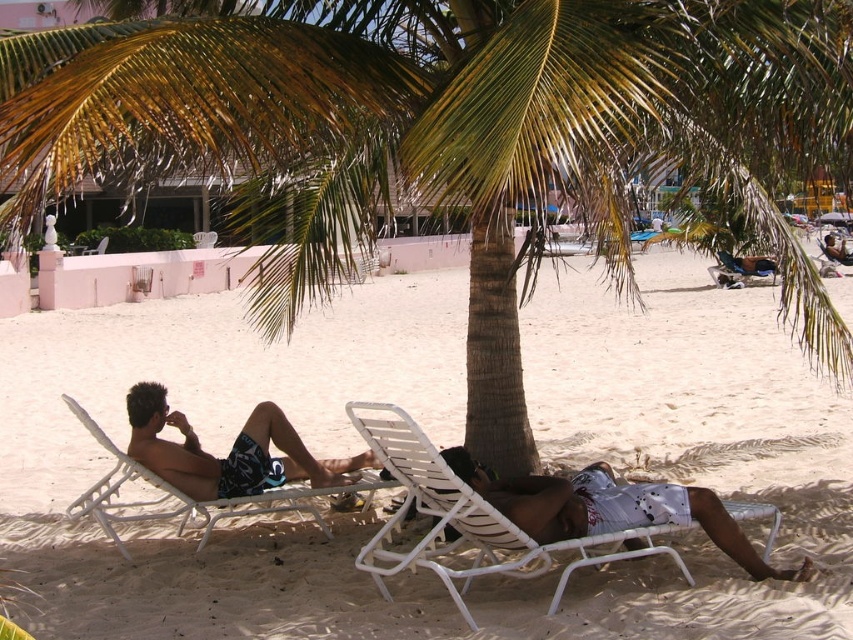
Question: Does white plastic beach chair at lower center appear under dark blue printed shorts at center?

Choices:
 (A) no
 (B) yes

Answer: (B)

Question: Is white plastic chair at left to the right of blue fabric beach chair at center from the viewer's perspective?

Choices:
 (A) no
 (B) yes

Answer: (A)

Question: In this image, where is white plastic beach chair at lower center located relative to white textured shorts at lower right?

Choices:
 (A) below
 (B) above

Answer: (A)

Question: Which point is closer to the camera?

Choices:
 (A) (590, 333)
 (B) (305, 241)
 (C) (386, 428)
 (D) (103, 244)

Answer: (C)

Question: Which point is farther to the camera?

Choices:
 (A) white sand at center
 (B) dark blue printed shorts at center
 (C) blue fabric beach chair at center
 (D) white textured shorts at lower right

Answer: (C)

Question: Which of these objects is positioned closest to the white plastic chair at center?

Choices:
 (A) white plastic chair at left
 (B) white textured shorts at lower right

Answer: (A)